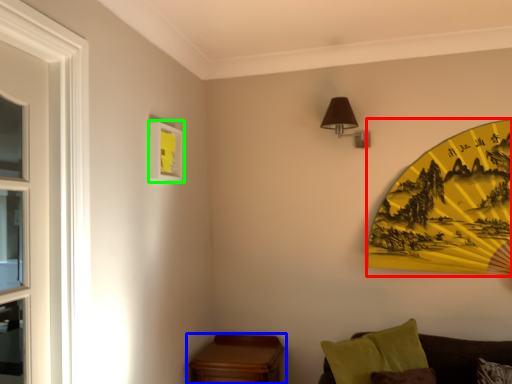
Question: Which object is positioned farthest from design (highlighted by a red box)? Select from table (highlighted by a blue box) and picture frame (highlighted by a green box).

Choices:
 (A) table
 (B) picture frame

Answer: (B)